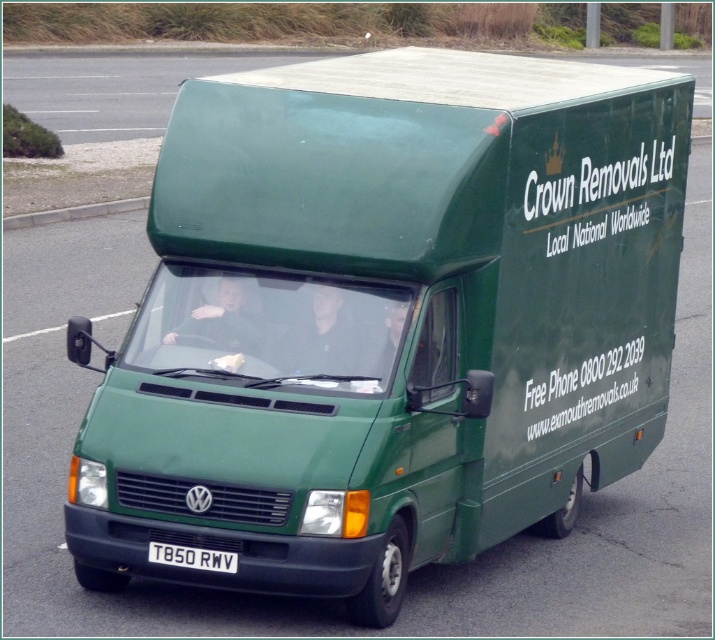
Does point (4, 220) lie behind point (212, 560)?

That is True.

Is gray concrete curb at left to the right of white plastic license plate at center from the viewer's perspective?

In fact, gray concrete curb at left is to the left of white plastic license plate at center.

Who is more forward, (54, 220) or (169, 552)?

Positioned in front is point (169, 552).

Identify the location of gray concrete curb at left. (73, 212).